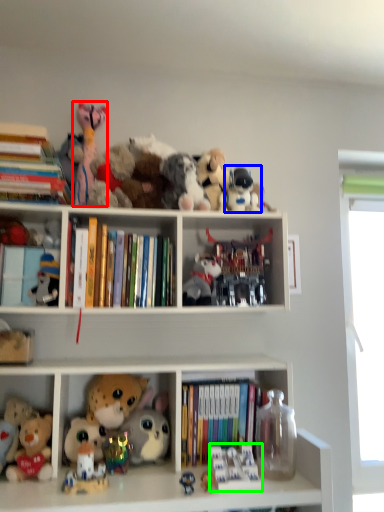
Question: Which object is the closest to the toy (highlighted by a red box)? Choose among these: toy (highlighted by a blue box) or toy (highlighted by a green box).

Choices:
 (A) toy
 (B) toy

Answer: (A)